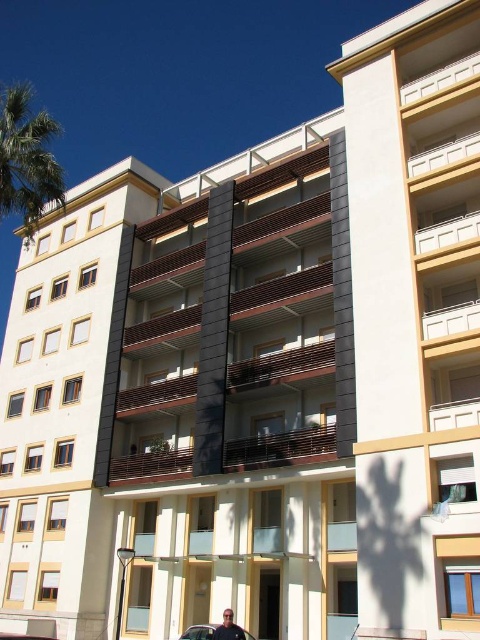
Question: Is brown wooden balcony at center wider than green leafy palm tree at upper left?

Choices:
 (A) no
 (B) yes

Answer: (A)

Question: Is brown wooden balcony at center to the right of shiny black sedan at lower center from the viewer's perspective?

Choices:
 (A) yes
 (B) no

Answer: (A)

Question: Which is nearer to the brown wooden balcony at center?

Choices:
 (A) green leafy palm tree at upper left
 (B) shiny black sedan at lower center
 (C) dark blue shirt at lower center

Answer: (A)

Question: Can you confirm if brown wooden balcony at center is wider than dark blue shirt at lower center?

Choices:
 (A) no
 (B) yes

Answer: (B)

Question: Which of these objects is positioned farthest from the shiny black sedan at lower center?

Choices:
 (A) green leafy palm tree at upper left
 (B) brown wooden balcony at center
 (C) dark blue shirt at lower center

Answer: (A)

Question: Based on their relative distances, which object is farther from the shiny black sedan at lower center?

Choices:
 (A) green leafy palm tree at upper left
 (B) brown wooden balcony at center
 (C) dark blue shirt at lower center

Answer: (A)